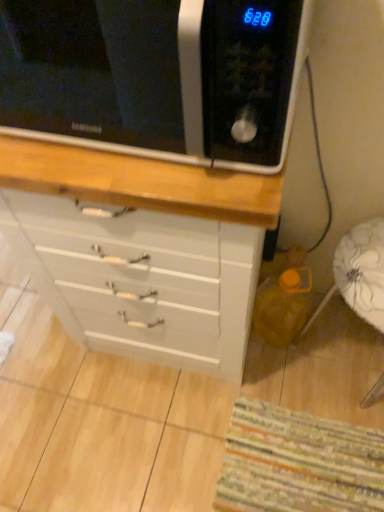
This screenshot has width=384, height=512. In order to click on blank space situated above striped fabric mat at lower right (from a real-world perspective) in this screenshot , I will do `click(307, 460)`.